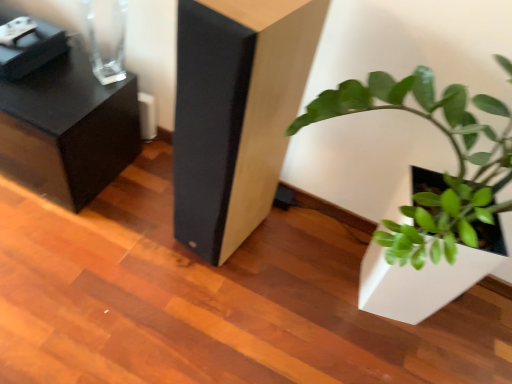
Question: Considering the relative sizes of black textured side table at upper left, the second furniture from the right, and green matte plant at lower right in the image provided, is black textured side table at upper left, the second furniture from the right, wider than green matte plant at lower right?

Choices:
 (A) no
 (B) yes

Answer: (A)

Question: From a real-world perspective, is black textured side table at upper left, the second furniture from the right, physically above green matte plant at lower right?

Choices:
 (A) yes
 (B) no

Answer: (B)

Question: Is black textured side table at upper left, the second furniture from the right, to the right of green matte plant at lower right from the viewer's perspective?

Choices:
 (A) no
 (B) yes

Answer: (A)

Question: Can you confirm if black textured side table at upper left, the second furniture from the right, is bigger than green matte plant at lower right?

Choices:
 (A) no
 (B) yes

Answer: (A)

Question: Is black textured side table at upper left, which appears as the first furniture when viewed from the left, beside green matte plant at lower right?

Choices:
 (A) yes
 (B) no

Answer: (B)

Question: Would you say black textured side table at upper left, the second furniture from the right, is to the left or to the right of matte black speaker at center, placed as the second furniture when sorted from left to right, in the picture?

Choices:
 (A) right
 (B) left

Answer: (B)

Question: Is black textured side table at upper left, the second furniture from the right, taller or shorter than matte black speaker at center, placed as the second furniture when sorted from left to right?

Choices:
 (A) tall
 (B) short

Answer: (B)

Question: Does point (62, 117) appear closer or farther from the camera than point (271, 134)?

Choices:
 (A) closer
 (B) farther

Answer: (B)

Question: From a real-world perspective, relative to matte black speaker at center, marked as the 1th furniture in a right-to-left arrangement, is black textured side table at upper left, which appears as the first furniture when viewed from the left, vertically above or below?

Choices:
 (A) above
 (B) below

Answer: (B)

Question: Is point (382, 294) positioned closer to the camera than point (256, 117)?

Choices:
 (A) closer
 (B) farther

Answer: (B)

Question: Considering their positions, is green matte plant at lower right located in front of or behind matte black speaker at center, marked as the 1th furniture in a right-to-left arrangement?

Choices:
 (A) front
 (B) behind

Answer: (A)

Question: In the image, is green matte plant at lower right on the left side or the right side of matte black speaker at center, marked as the 1th furniture in a right-to-left arrangement?

Choices:
 (A) left
 (B) right

Answer: (B)

Question: Looking at their shapes, would you say green matte plant at lower right is wider or thinner than matte black speaker at center, marked as the 1th furniture in a right-to-left arrangement?

Choices:
 (A) thin
 (B) wide

Answer: (B)

Question: From the image's perspective, is green matte plant at lower right above or below black textured side table at upper left, the second furniture from the right?

Choices:
 (A) below
 (B) above

Answer: (A)

Question: Would you say green matte plant at lower right is to the left or to the right of black textured side table at upper left, which appears as the first furniture when viewed from the left, in the picture?

Choices:
 (A) left
 (B) right

Answer: (B)